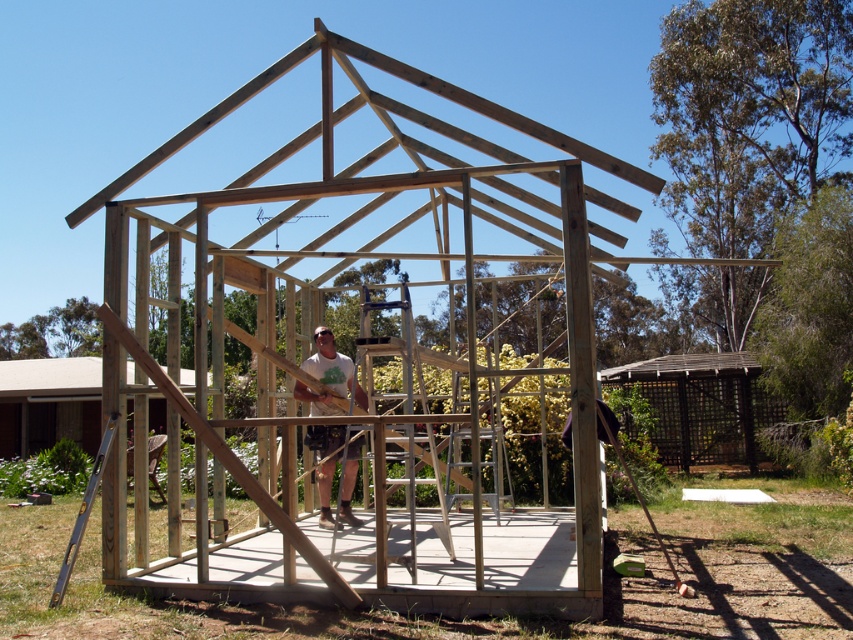
In the scene shown: You are a construction worker who needs to place a new support beam that is 2 meters tall. Based on the scene, will the wooden planks at center be able to support the beam if placed on top of the natural wood frame at center?

The natural wood frame at center is taller than wooden planks at center, so the wooden planks at center are shorter. Since the beam is 2 meters tall, if the natural wood frame provides sufficient height, the planks may not be tall enough to support it properly. However, the exact compatibility depends on the frame and planks dimensions beyond the given info.

You are standing at the construction site and want to reach the ladder leaning against the wooden frame structure. There are two points marked on the structure. Which point is closer to you, point (642, 364) or point (38, 428)?

Point (642, 364) is closer to the camera than point (38, 428), so the point closer to you is point (642, 364).

You are a construction worker trying to place a new piece of wood between the natural wood frame at center and the wooden planks at center. According to the scene, which object should you move the new piece of wood towards to ensure it is correctly placed?

The natural wood frame at center is positioned on the left side of wooden planks at center. To place the new piece of wood correctly between them, you should move it towards the natural wood frame at center since it is on the left side of the wooden planks at center.